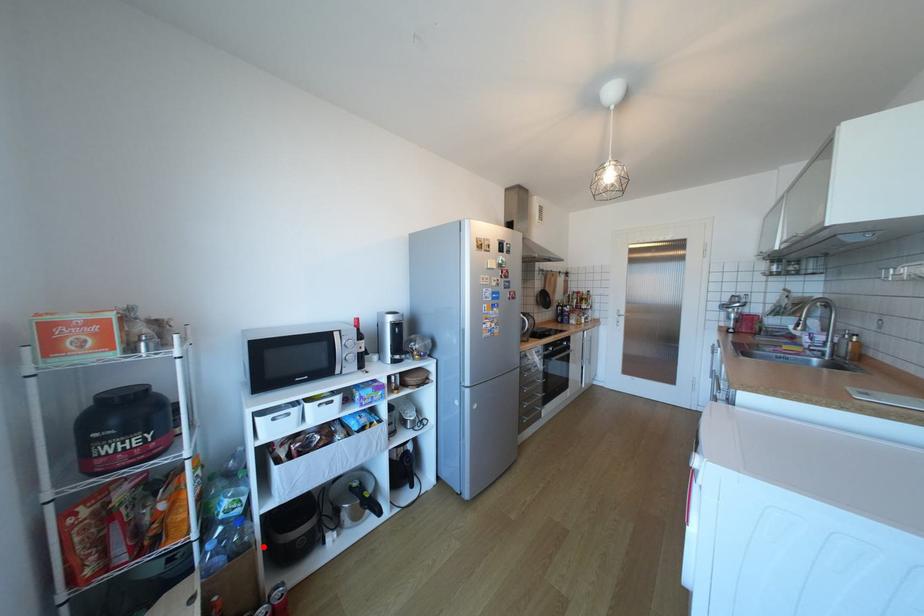
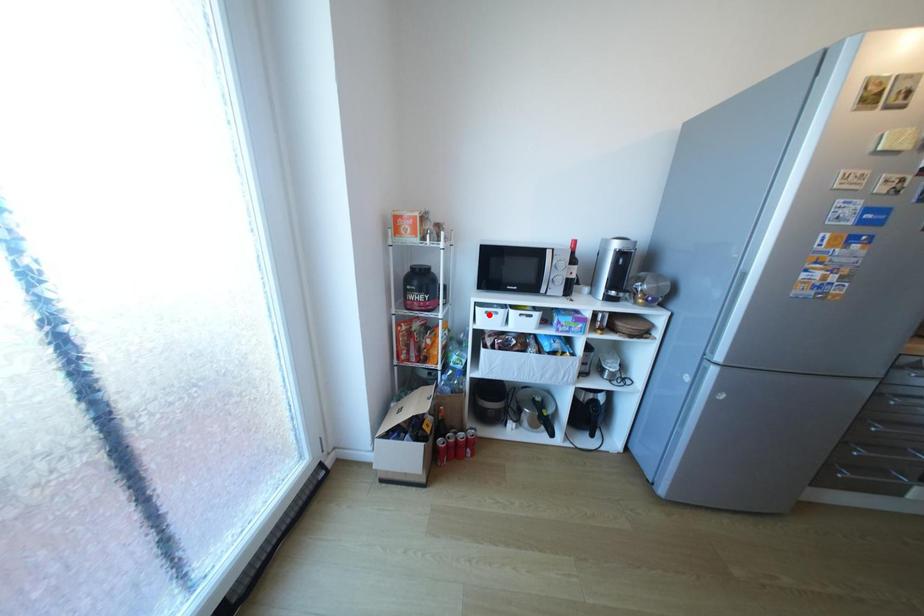
I am providing you with two images of the same scene from different viewpoints. A red point is marked on the first image and another point is marked on the second image. Does the point marked in image1 correspond to the same location as the one in image2?

No